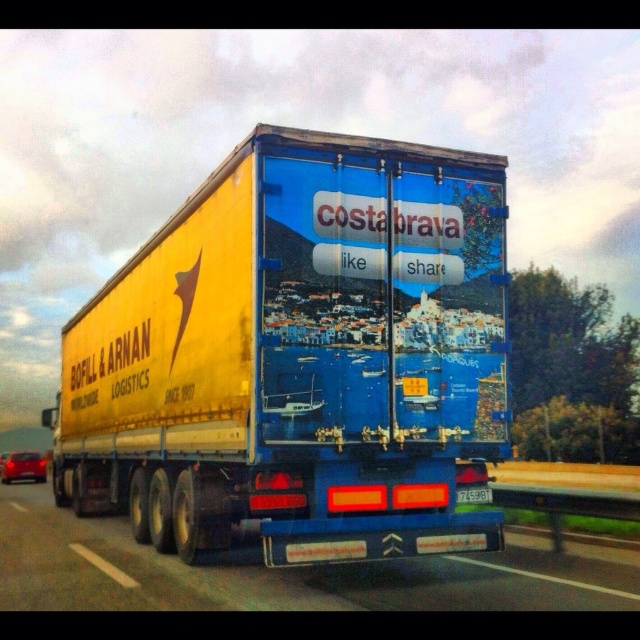
How much distance is there between yellow matte trailer at center and blue glossy truck at center?

A distance of 1.79 meters exists between yellow matte trailer at center and blue glossy truck at center.

Looking at this image, does yellow matte trailer at center appear over blue glossy truck at center?

Incorrect, yellow matte trailer at center is not positioned above blue glossy truck at center.

Does point (346, 538) come behind point (204, 580)?

No, it is not.

You are a GUI agent. You are given a task and a screenshot of the screen. Output one action in this format:
    pyautogui.click(x=<x>, y=<y>)
    Task: Click on the yellow matte trailer at center
    The image size is (640, 640).
    Given the screenshot: What is the action you would take?
    pyautogui.click(x=300, y=356)